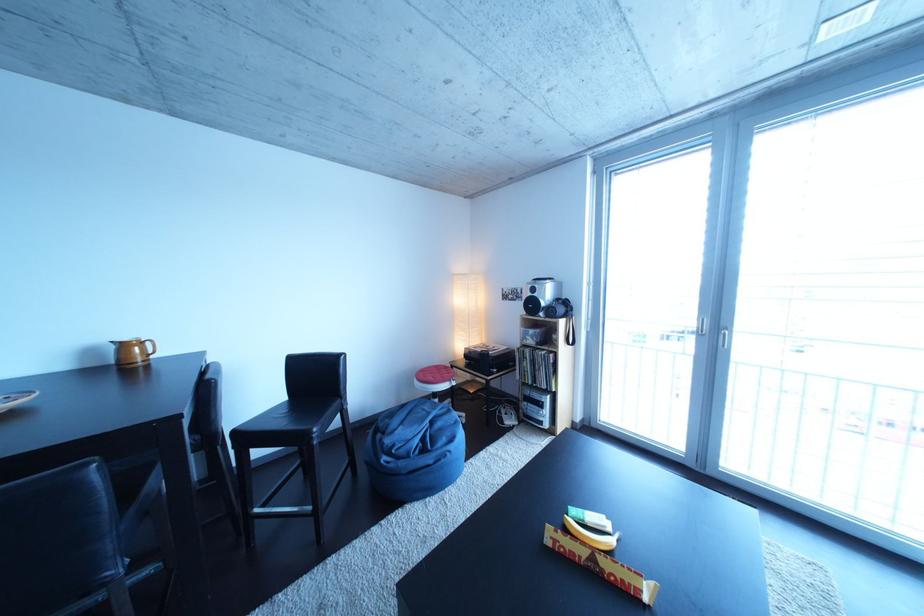
Where would you lift the black binoculars? Please return your answer as a coordinate pair (x, y).

(557, 308)